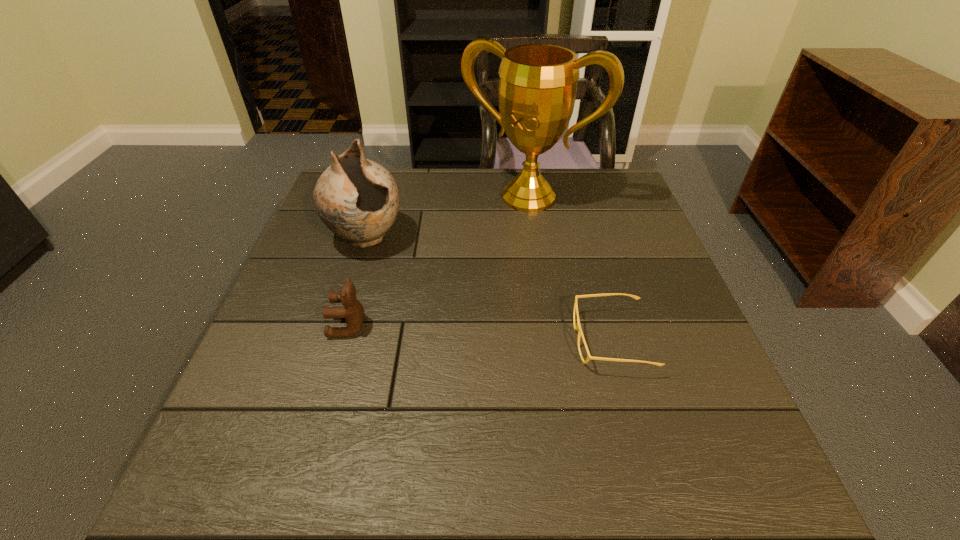
At what (x,y) coordinates should I click in order to perform the action: click on free region that satisfies the following two spatial constraints: 1. on the front side of the third shortest object; 2. on the face of the teddy bear. Please return your answer as a coordinate pair (x, y). Looking at the image, I should click on (339, 326).

This screenshot has height=540, width=960. Identify the location of vacant area in the image that satisfies the following two spatial constraints: 1. on the front side of the shortest object; 2. in front of the lenses of the tallest object. pos(549,340).

Where is `free point that satisfies the following two spatial constraints: 1. on the front side of the third shortest object; 2. in front of the lenses of the shortest object`? free point that satisfies the following two spatial constraints: 1. on the front side of the third shortest object; 2. in front of the lenses of the shortest object is located at coordinates (335, 340).